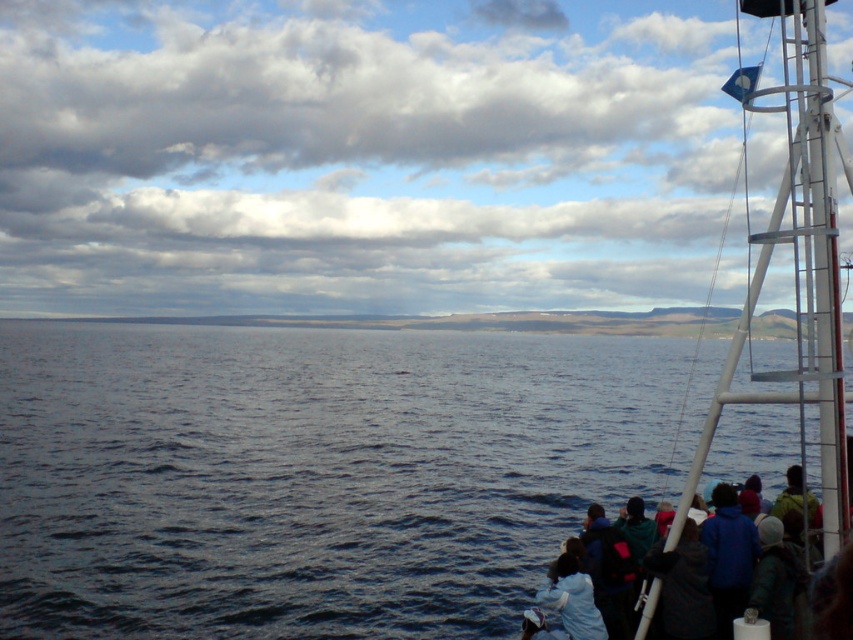
You are standing on the deck of the boat and want to move from the white metal boat at right to the blue jacket at lower right. Which object is closer to you?

The white metal boat at right is closer to you because it is further to the viewer than the blue jacket at lower right.

From the picture: You are standing on the deck of the boat and want to estimate how far the dark blue water at center is from you. Based on the scene, can you determine the distance in feet?

The dark blue water at center is 43.12 feet away from the viewer.